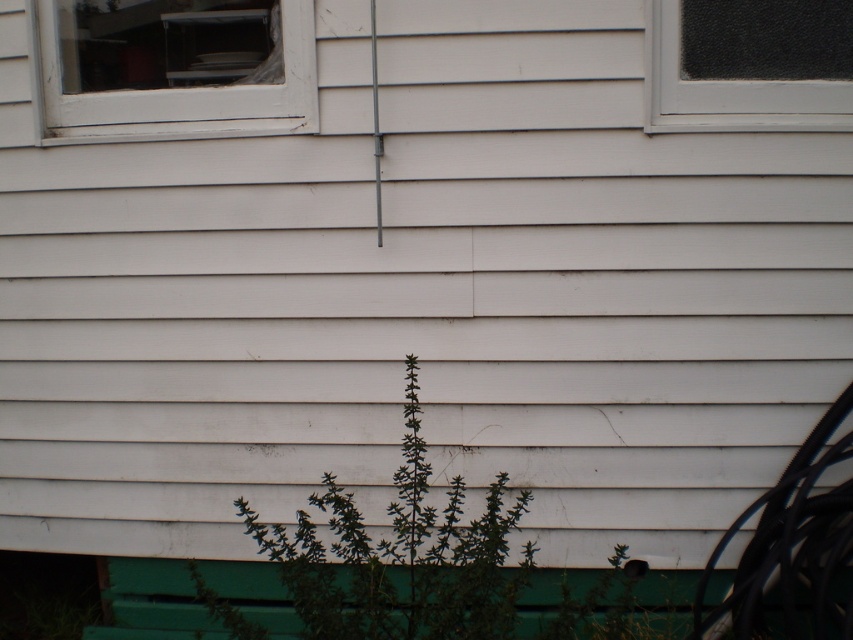
Question: Which object is positioned farthest from the clear glass window at upper right?

Choices:
 (A) green painted wood park bench at lower center
 (B) white plastic window at upper left

Answer: (A)

Question: Can you confirm if green leafy plant at center is positioned to the right of green painted wood park bench at lower center?

Choices:
 (A) yes
 (B) no

Answer: (A)

Question: Can you confirm if white plastic window at upper left is wider than green painted wood park bench at lower center?

Choices:
 (A) no
 (B) yes

Answer: (B)

Question: Which point is closer to the camera?

Choices:
 (A) (485, 561)
 (B) (144, 627)

Answer: (A)

Question: Which object is the closest to the green leafy plant at center?

Choices:
 (A) green painted wood park bench at lower center
 (B) white plastic window at upper left
 (C) clear glass window at upper right

Answer: (A)

Question: Does white plastic window at upper left have a larger size compared to clear glass window at upper right?

Choices:
 (A) yes
 (B) no

Answer: (A)